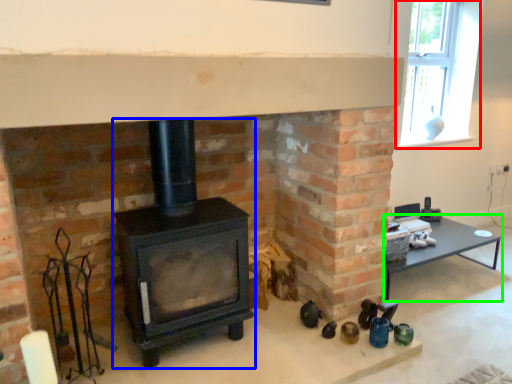
Question: Considering the real-world distances, which object is closest to window (highlighted by a red box)? wood burning stove (highlighted by a blue box) or table (highlighted by a green box).

Choices:
 (A) wood burning stove
 (B) table

Answer: (B)